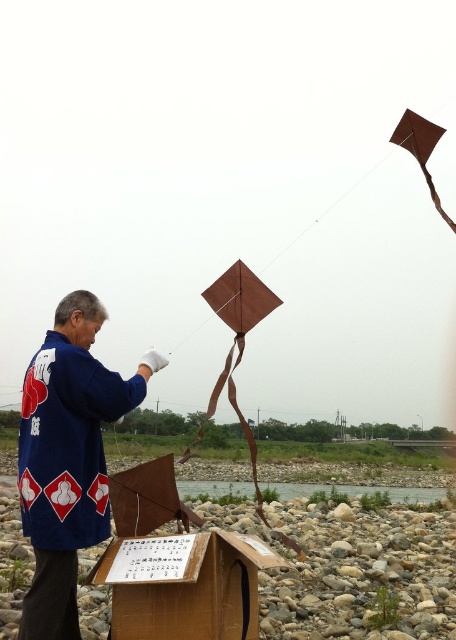
You are a photographer trying to capture a photo of the blue fabric jacket at center and the brown cardboard box at lower center. Which object should you focus on first if you want to ensure both are in focus without adjusting your camera settings? Explain your reasoning based on their positions.

The blue fabric jacket at center is taller than the brown cardboard box at lower center. Since the jacket is taller, it might be positioned farther away from the camera, requiring a larger depth of field to keep both in focus. However, without knowing their exact distances, focusing on the jacket first ensures its clarity, while the box, being shorter and closer, may naturally stay in focus due to its proximity.

You are a kite enthusiast who wants to retrieve the brown matte kite at upper right from the sky. You are currently standing next to the brown cardboard box at lower center. Which direction should you look to see the kite?

The brown cardboard box at lower center is located below the brown matte kite at upper right, so you should look upwards to see the kite.